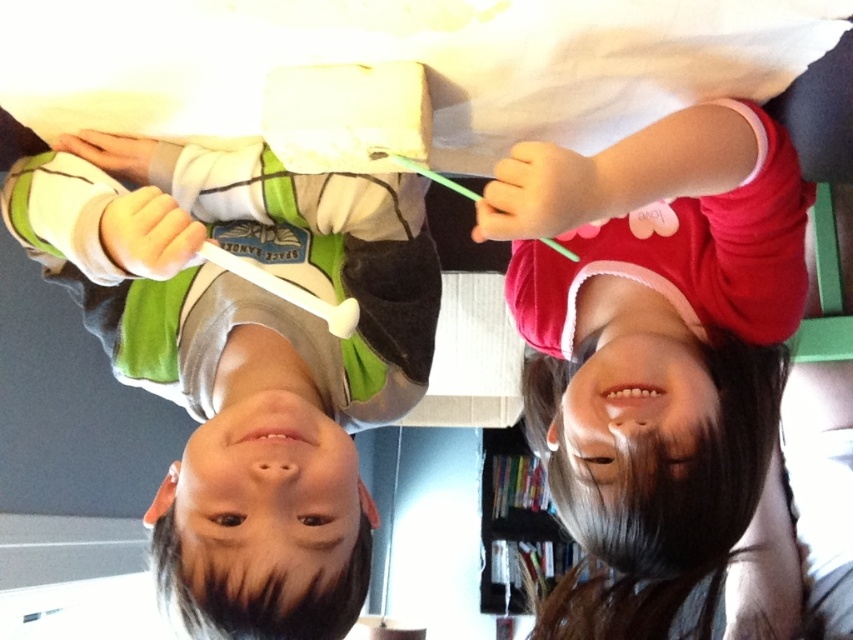
Question: Does matte green and white shirt at left have a lesser width compared to matte pink hoodie at upper right?

Choices:
 (A) yes
 (B) no

Answer: (B)

Question: Observing the image, what is the correct spatial positioning of matte green and white shirt at left in reference to matte pink hoodie at upper right?

Choices:
 (A) below
 (B) above

Answer: (B)

Question: Which of the following is the closest to the observer?

Choices:
 (A) (263, 154)
 (B) (543, 186)

Answer: (B)

Question: Which object appears closest to the camera in this image?

Choices:
 (A) matte pink hoodie at upper right
 (B) matte green and white shirt at left

Answer: (A)

Question: Can you confirm if matte green and white shirt at left is bigger than matte pink hoodie at upper right?

Choices:
 (A) no
 (B) yes

Answer: (A)